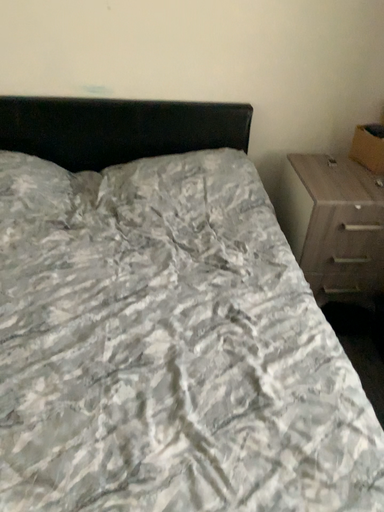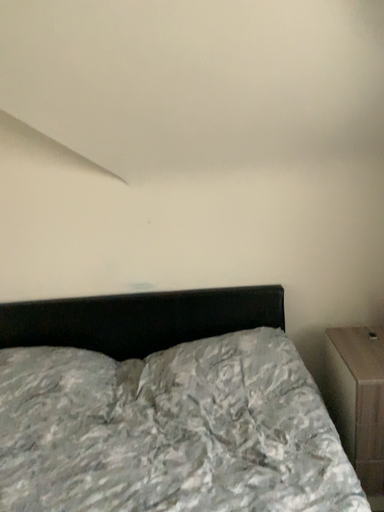
Question: How did the camera likely rotate when shooting the video?

Choices:
 (A) rotated left
 (B) rotated right

Answer: (A)